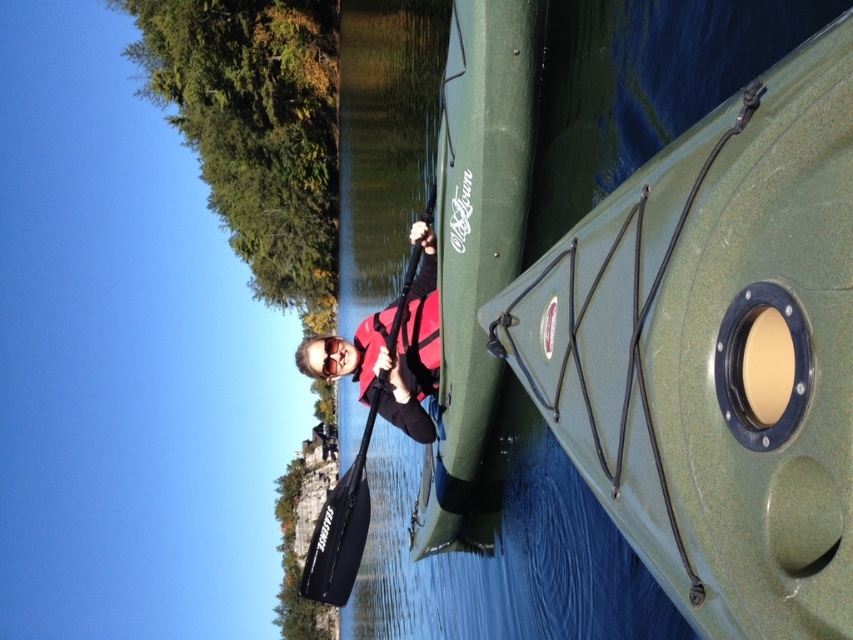
Question: Which point is farther to the camera?

Choices:
 (A) black rubber paddle at center
 (B) matte red life vest at center
 (C) orange life jacket at center
 (D) green rubber kayak at center

Answer: (A)

Question: Does matte red life vest at center appear under black rubber paddle at center?

Choices:
 (A) no
 (B) yes

Answer: (B)

Question: Is green rubber boat at center thinner than black rubber paddle at center?

Choices:
 (A) no
 (B) yes

Answer: (B)

Question: Among these points, which one is farthest from the camera?

Choices:
 (A) (367, 365)
 (B) (428, 596)
 (C) (662, 268)

Answer: (B)

Question: Which point is closer to the camera?

Choices:
 (A) (384, 406)
 (B) (393, 113)
 (C) (431, 348)
 (D) (373, 401)

Answer: (D)

Question: Is matte red life vest at center below orange life jacket at center?

Choices:
 (A) yes
 (B) no

Answer: (B)